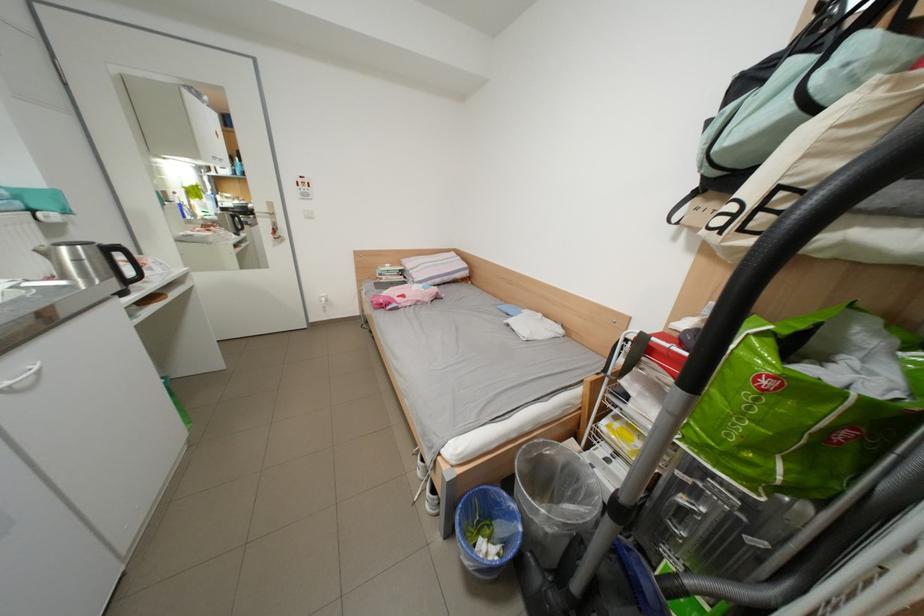
Where is `green shopping bag`? This screenshot has width=924, height=616. green shopping bag is located at coordinates [x=801, y=405].